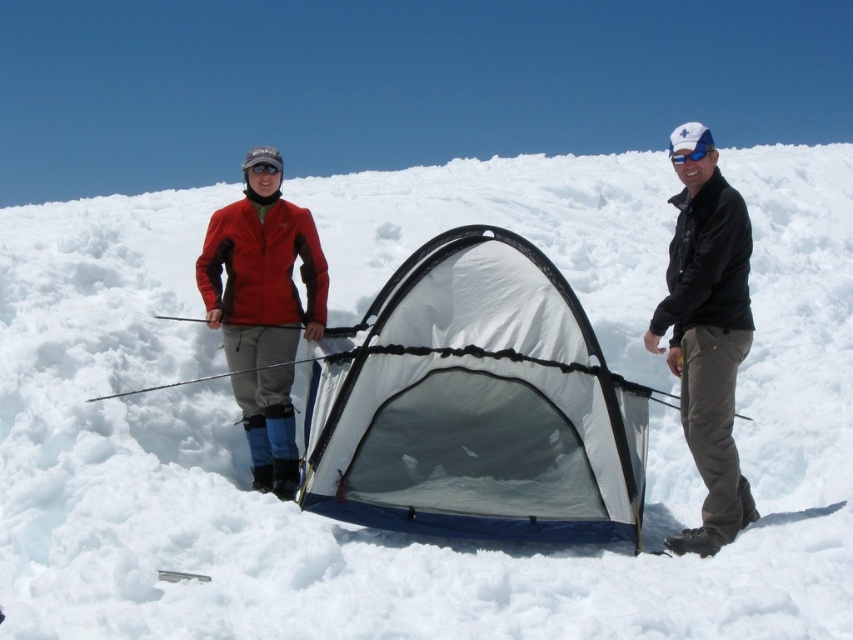
Is white mesh tent at center thinner than blue reflective lens goggles at upper right?

Incorrect, white mesh tent at center's width is not less than blue reflective lens goggles at upper right's.

Is point (416, 284) farther from camera compared to point (711, 150)?

Yes, it is.

At what (x,y) coordinates should I click in order to perform the action: click on white mesh tent at center. Please return your answer as a coordinate pair (x, y). Looking at the image, I should click on (474, 404).

Is point (433, 486) positioned before point (320, 324)?

Yes, it is.

Between point (363, 429) and point (225, 348), which one is positioned in front?

Point (363, 429) is in front.

At what (x,y) coordinates should I click in order to perform the action: click on white mesh tent at center. Please return your answer as a coordinate pair (x, y). The height and width of the screenshot is (640, 853). Looking at the image, I should click on (474, 404).

Is black leather jacket at right wider than matte red jacket at center?

No.

Does black leather jacket at right appear under matte red jacket at center?

Yes, black leather jacket at right is below matte red jacket at center.

Between point (712, 508) and point (282, 433), which one is positioned in front?

Point (712, 508) is more forward.

Image resolution: width=853 pixels, height=640 pixels. Identify the location of black leather jacket at right. (708, 342).